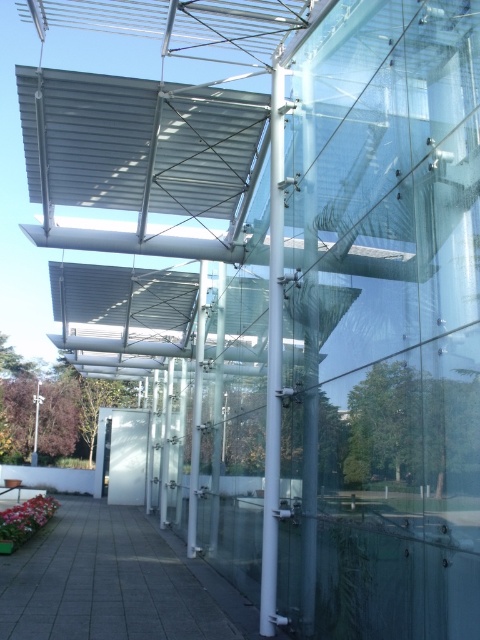
Does white glossy pole at center have a greater width compared to clear glass pillar at center?

In fact, white glossy pole at center might be narrower than clear glass pillar at center.

Between point (277, 109) and point (216, 310), which one is positioned behind?

The point (216, 310) is behind.

The image size is (480, 640). Describe the element at coordinates (274, 362) in the screenshot. I see `white glossy pole at center` at that location.

Identify the location of white glossy pole at center. The image size is (480, 640). (274, 362).

Who is positioned more to the left, metallic gray canopy at upper center or clear glass pillar at center?

metallic gray canopy at upper center

Can you confirm if metallic gray canopy at upper center is taller than clear glass pillar at center?

No.

Measure the distance between point [199,184] and camera.

Point [199,184] and camera are 8.56 meters apart.

Where is `metallic gray canopy at upper center`? This screenshot has width=480, height=640. metallic gray canopy at upper center is located at coordinates (137, 141).

Is white glossy pole at center closer to camera compared to white glossy pillar at center?

Yes, it is.

Can you confirm if white glossy pole at center is smaller than white glossy pillar at center?

Correct, white glossy pole at center occupies less space than white glossy pillar at center.

You are a GUI agent. You are given a task and a screenshot of the screen. Output one action in this format:
    pyautogui.click(x=<x>, y=<y>)
    Task: Click on the white glossy pole at center
    
    Given the screenshot: What is the action you would take?
    pyautogui.click(x=274, y=362)